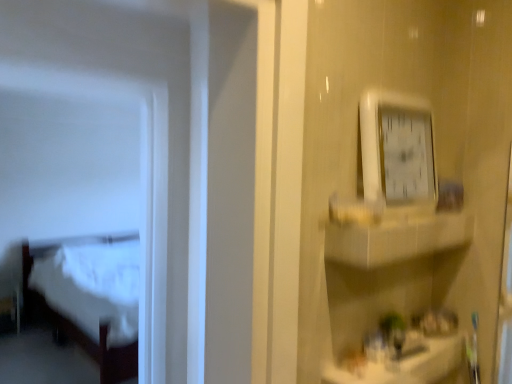
Question: Does white wood bed at left have a lesser height compared to white glossy counter top at lower right?

Choices:
 (A) no
 (B) yes

Answer: (A)

Question: Does white wood bed at left have a greater height compared to white glossy counter top at lower right?

Choices:
 (A) no
 (B) yes

Answer: (B)

Question: Does white wood bed at left have a lesser width compared to white glossy counter top at lower right?

Choices:
 (A) no
 (B) yes

Answer: (A)

Question: Is white wood bed at left further to the viewer compared to white glossy counter top at lower right?

Choices:
 (A) yes
 (B) no

Answer: (A)

Question: From the image's perspective, does white wood bed at left appear lower than white glossy counter top at lower right?

Choices:
 (A) no
 (B) yes

Answer: (B)

Question: Considering the positions of white plastic clock at upper right and white glossy counter top at lower right in the image, is white plastic clock at upper right bigger or smaller than white glossy counter top at lower right?

Choices:
 (A) big
 (B) small

Answer: (B)

Question: In terms of height, does white plastic clock at upper right look taller or shorter compared to white glossy counter top at lower right?

Choices:
 (A) short
 (B) tall

Answer: (B)

Question: Relative to white glossy counter top at lower right, is white plastic clock at upper right in front or behind?

Choices:
 (A) front
 (B) behind

Answer: (B)

Question: Considering the positions of white plastic clock at upper right and white glossy counter top at lower right in the image, is white plastic clock at upper right wider or thinner than white glossy counter top at lower right?

Choices:
 (A) wide
 (B) thin

Answer: (B)

Question: Considering their positions, is white glossy cabinet at upper right located in front of or behind white plastic clock at upper right?

Choices:
 (A) front
 (B) behind

Answer: (A)

Question: Do you think white glossy cabinet at upper right is within white plastic clock at upper right, or outside of it?

Choices:
 (A) outside
 (B) inside

Answer: (A)

Question: From the image's perspective, is white glossy cabinet at upper right above or below white plastic clock at upper right?

Choices:
 (A) below
 (B) above

Answer: (A)

Question: Considering the positions of white glossy cabinet at upper right and white plastic clock at upper right in the image, is white glossy cabinet at upper right wider or thinner than white plastic clock at upper right?

Choices:
 (A) wide
 (B) thin

Answer: (A)

Question: Looking at the image, does white wood bed at left seem bigger or smaller compared to white glossy cabinet at upper right?

Choices:
 (A) small
 (B) big

Answer: (B)

Question: Considering their positions, is white wood bed at left located in front of or behind white glossy cabinet at upper right?

Choices:
 (A) front
 (B) behind

Answer: (B)